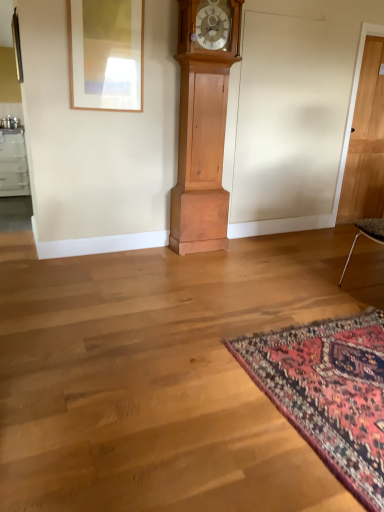
Where is `vacant region to the right of light brown wood grandfather clock at center`? vacant region to the right of light brown wood grandfather clock at center is located at coordinates (248, 247).